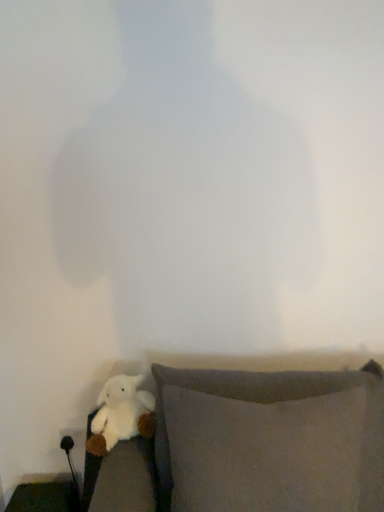
Question: Is white plush toy at lower left facing towards matte black side table at lower left, positioned as the first furniture in left-to-right order?

Choices:
 (A) yes
 (B) no

Answer: (B)

Question: Is white plush toy at lower left shorter than matte black side table at lower left, positioned as the first furniture in left-to-right order?

Choices:
 (A) no
 (B) yes

Answer: (A)

Question: Is white plush toy at lower left in front of matte black side table at lower left, positioned as the first furniture in bottom-to-top order?

Choices:
 (A) yes
 (B) no

Answer: (A)

Question: From the image's perspective, does white plush toy at lower left appear lower than matte black side table at lower left, positioned as the first furniture in left-to-right order?

Choices:
 (A) yes
 (B) no

Answer: (B)

Question: From a real-world perspective, does white plush toy at lower left stand above matte black side table at lower left, which ranks as the 1th furniture in back-to-front order?

Choices:
 (A) yes
 (B) no

Answer: (A)

Question: In the image, is matte black side table at lower left, positioned as the first furniture in left-to-right order, positioned in front of or behind gray fabric pillow at lower right, which is the 2th furniture in bottom-to-top order?

Choices:
 (A) behind
 (B) front

Answer: (A)

Question: Is matte black side table at lower left, arranged as the second furniture when viewed from the right, to the left or to the right of gray fabric pillow at lower right, which is counted as the 1th furniture, starting from the front, in the image?

Choices:
 (A) left
 (B) right

Answer: (A)

Question: From a real-world perspective, is matte black side table at lower left, positioned as the second furniture in front-to-back order, positioned above or below gray fabric pillow at lower right, which is the 2th furniture in bottom-to-top order?

Choices:
 (A) above
 (B) below

Answer: (B)

Question: Is point (23, 499) positioned closer to the camera than point (120, 446)?

Choices:
 (A) closer
 (B) farther

Answer: (B)

Question: Based on their positions, is white plush toy at lower left located to the left or right of matte black side table at lower left, placed as the second furniture when sorted from top to bottom?

Choices:
 (A) right
 (B) left

Answer: (A)

Question: In terms of width, does white plush toy at lower left look wider or thinner when compared to matte black side table at lower left, which ranks as the 1th furniture in back-to-front order?

Choices:
 (A) wide
 (B) thin

Answer: (A)

Question: In terms of height, does white plush toy at lower left look taller or shorter compared to matte black side table at lower left, arranged as the second furniture when viewed from the right?

Choices:
 (A) tall
 (B) short

Answer: (A)

Question: Looking at the image, does white plush toy at lower left seem bigger or smaller compared to matte black side table at lower left, placed as the second furniture when sorted from top to bottom?

Choices:
 (A) small
 (B) big

Answer: (A)

Question: Considering the positions of gray fabric pillow at lower right, the 1th furniture positioned from the top, and white plush toy at lower left in the image, is gray fabric pillow at lower right, the 1th furniture positioned from the top, taller or shorter than white plush toy at lower left?

Choices:
 (A) short
 (B) tall

Answer: (B)

Question: Visually, is gray fabric pillow at lower right, acting as the second furniture starting from the back, positioned to the left or to the right of white plush toy at lower left?

Choices:
 (A) left
 (B) right

Answer: (B)